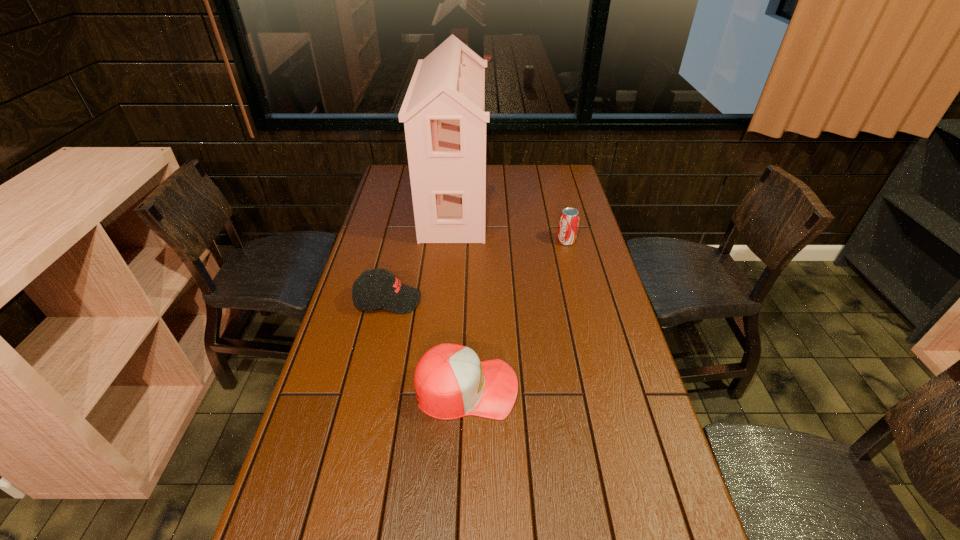
Where is `object at the far edge`? The width and height of the screenshot is (960, 540). object at the far edge is located at coordinates (443, 112).

Image resolution: width=960 pixels, height=540 pixels. Identify the location of object present at the left edge. (369, 293).

Identify the location of object at the right edge. (569, 218).

Find the location of a particular element. This screenshot has height=540, width=960. free space at the far edge of the desktop is located at coordinates (535, 173).

This screenshot has width=960, height=540. In the image, there is a desktop. What are the coordinates of `free space at the left edge` in the screenshot? It's located at (315, 484).

Locate an element on the screen. The width and height of the screenshot is (960, 540). free space at the right edge of the desktop is located at coordinates (550, 205).

Find the location of a particular element. This screenshot has height=540, width=960. vacant space at the far left corner is located at coordinates (404, 188).

The width and height of the screenshot is (960, 540). Find the location of `vacant region at the far right corner of the desktop`. vacant region at the far right corner of the desktop is located at coordinates (556, 173).

The width and height of the screenshot is (960, 540). Find the location of `empty space between the dollhouse and the rightmost object`. empty space between the dollhouse and the rightmost object is located at coordinates (510, 222).

Identify the location of blank region between the rightmost object and the second nearest object. The width and height of the screenshot is (960, 540). (477, 271).